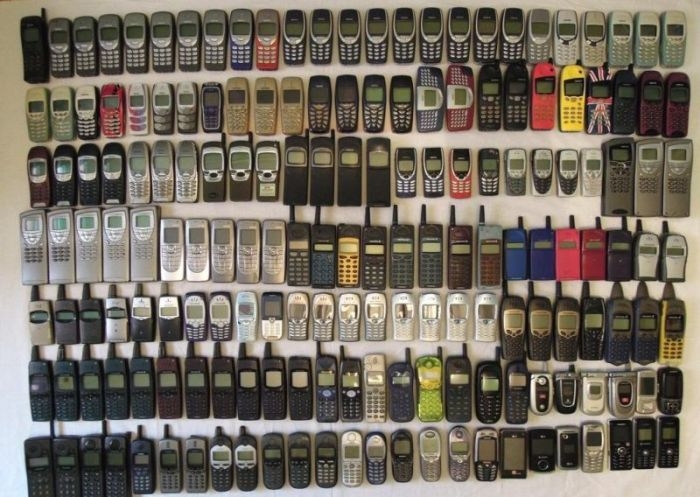
At what (x,y) coordinates should I click in order to perform the action: click on phones. Please return your answer as a coordinate pair (x, y). The width and height of the screenshot is (700, 497). Looking at the image, I should click on (440, 124).